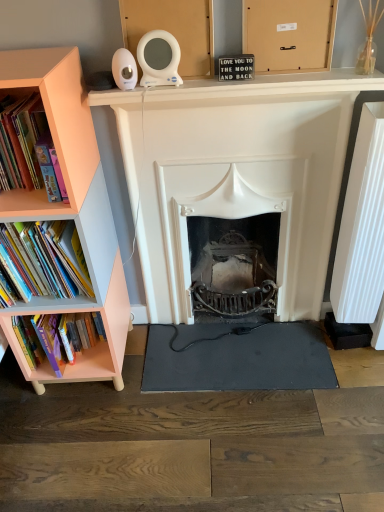
Where is `vacant area that is in front of white matte fireplace at center`? vacant area that is in front of white matte fireplace at center is located at coordinates (236, 437).